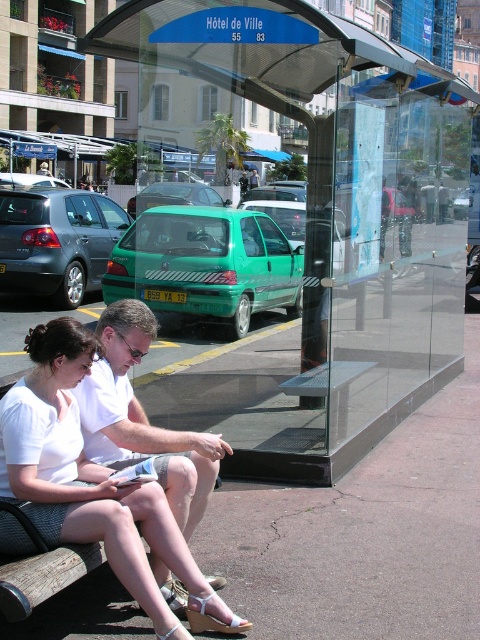
Question: Considering the relative positions of transparent glass bus stop at center and green matte car at center in the image provided, where is transparent glass bus stop at center located with respect to green matte car at center?

Choices:
 (A) left
 (B) right

Answer: (B)

Question: Estimate the real-world distances between objects in this image. Which object is farther from the transparent glass bus stop at center?

Choices:
 (A) green matte car at center
 (B) white cotton shirt at center

Answer: (B)

Question: Is green matte car at center closer to camera compared to white cotton shirt at center?

Choices:
 (A) yes
 (B) no

Answer: (B)

Question: In this image, where is transparent glass bus stop at center located relative to white cotton shirt at center?

Choices:
 (A) below
 (B) above

Answer: (B)

Question: Which object is farther from the camera taking this photo?

Choices:
 (A) transparent glass bus stop at center
 (B) green matte car at center
 (C) white cotton shirt at center

Answer: (B)

Question: Considering the real-world distances, which object is farthest from the transparent glass bus stop at center?

Choices:
 (A) green matte car at center
 (B) white cotton shirt at center

Answer: (B)